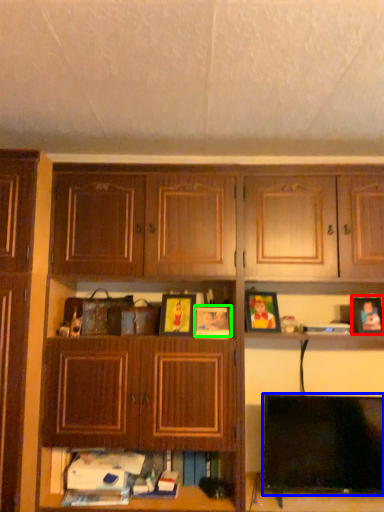
Question: Estimate the real-world distances between objects in this image. Which object is closer to picture frame (highlighted by a red box), television (highlighted by a blue box) or picture frame (highlighted by a green box)?

Choices:
 (A) television
 (B) picture frame

Answer: (A)